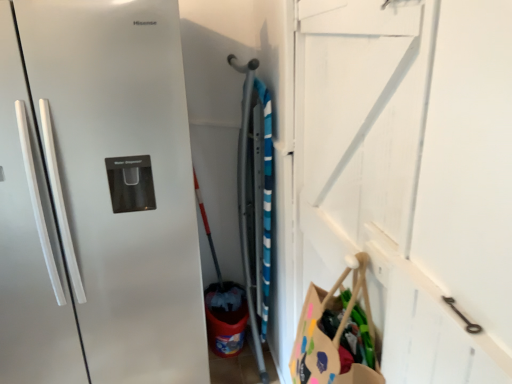
Find the location of a particular element. This screenshot has width=512, height=384. white wooden door at upper right is located at coordinates (411, 173).

In order to face white wooden door at upper right, should I rotate leftwards or rightwards?

It's best to rotate right around 16.725 degrees.

Measure the distance between point (x=311, y=240) and camera.

A distance of 5.24 feet exists between point (x=311, y=240) and camera.

What do you see at coordinates (411, 173) in the screenshot? I see `white wooden door at upper right` at bounding box center [411, 173].

At what (x,y) coordinates should I click in order to perform the action: click on satin white refrigerator handles at left. Please return your answer as a coordinate pair (x, y). The image size is (512, 384). Looking at the image, I should click on (29, 245).

Describe the element at coordinates (29, 245) in the screenshot. I see `satin white refrigerator handles at left` at that location.

At what (x,y) coordinates should I click in order to perform the action: click on white wooden door at upper right. Please return your answer as a coordinate pair (x, y). Looking at the image, I should click on (411, 173).

Is white wooden door at upper right to the right of satin white refrigerator handles at left from the viewer's perspective?

Yes, white wooden door at upper right is to the right of satin white refrigerator handles at left.

Which object is closer to the camera taking this photo, white wooden door at upper right or satin white refrigerator handles at left?

satin white refrigerator handles at left is more forward.

Which is further, [389,382] or [0,143]?

The point [0,143] is behind.

From the image's perspective, relative to satin white refrigerator handles at left, is white wooden door at upper right above or below?

white wooden door at upper right is situated higher than satin white refrigerator handles at left in the image.

From a real-world perspective, is white wooden door at upper right located beneath satin white refrigerator handles at left?

Yes, from a real-world perspective, white wooden door at upper right is under satin white refrigerator handles at left.

Considering the sizes of white wooden door at upper right and satin white refrigerator handles at left in the image, is white wooden door at upper right wider or thinner than satin white refrigerator handles at left?

Considering their sizes, white wooden door at upper right looks broader than satin white refrigerator handles at left.

Does white wooden door at upper right have a greater height compared to satin white refrigerator handles at left?

Correct, white wooden door at upper right is much taller as satin white refrigerator handles at left.

Consider the image. Is white wooden door at upper right bigger or smaller than satin white refrigerator handles at left?

Clearly, white wooden door at upper right is larger in size than satin white refrigerator handles at left.

Is satin white refrigerator handles at left completely or partially inside white wooden door at upper right?

No, satin white refrigerator handles at left is not inside white wooden door at upper right.

Is white wooden door at upper right next to satin white refrigerator handles at left and touching it?

white wooden door at upper right and satin white refrigerator handles at left are clearly separated.

Does white wooden door at upper right turn towards satin white refrigerator handles at left?

No.

Looking at this image, how many degrees apart are the facing directions of white wooden door at upper right and satin white refrigerator handles at left?

white wooden door at upper right and satin white refrigerator handles at left are facing 1.04 degrees away from each other.

The height and width of the screenshot is (384, 512). What are the coordinates of `garage door that is behind the satin white refrigerator handles at left` in the screenshot? It's located at (411, 173).

Is satin white refrigerator handles at left to the left of white wooden door at upper right from the viewer's perspective?

Correct, you'll find satin white refrigerator handles at left to the left of white wooden door at upper right.

Which is behind, satin white refrigerator handles at left or white wooden door at upper right?

white wooden door at upper right is behind.

Which is nearer, (13, 118) or (470, 274)?

Point (13, 118) appears to be farther away from the viewer than point (470, 274).

From the image's perspective, is satin white refrigerator handles at left below white wooden door at upper right?

Yes, from the image's perspective, satin white refrigerator handles at left is below white wooden door at upper right.

Consider the image. From a real-world perspective, is satin white refrigerator handles at left positioned under white wooden door at upper right based on gravity?

No, from a real-world perspective, satin white refrigerator handles at left is not under white wooden door at upper right.

Considering the sizes of objects satin white refrigerator handles at left and white wooden door at upper right in the image provided, who is thinner, satin white refrigerator handles at left or white wooden door at upper right?

Thinner between the two is satin white refrigerator handles at left.

Is satin white refrigerator handles at left taller or shorter than white wooden door at upper right?

Clearly, satin white refrigerator handles at left is shorter compared to white wooden door at upper right.

Between satin white refrigerator handles at left and white wooden door at upper right, which one has larger size?

white wooden door at upper right.

Looking at this image, do you think satin white refrigerator handles at left is within white wooden door at upper right, or outside of it?

satin white refrigerator handles at left is located beyond the bounds of white wooden door at upper right.

Based on the photo, is satin white refrigerator handles at left not close to white wooden door at upper right?

satin white refrigerator handles at left is positioned a significant distance from white wooden door at upper right.

Is satin white refrigerator handles at left oriented towards white wooden door at upper right?

No.

Can you tell me how much satin white refrigerator handles at left and white wooden door at upper right differ in facing direction?

They differ by 1.04 degrees in their facing directions.

Where is `garage door that appears below the satin white refrigerator handles at left (from a real-world perspective)`? This screenshot has width=512, height=384. garage door that appears below the satin white refrigerator handles at left (from a real-world perspective) is located at coordinates (411, 173).

Locate an element on the screen. This screenshot has height=384, width=512. garage door that is above the satin white refrigerator handles at left (from the image's perspective) is located at coordinates (411, 173).

Identify the location of garage door on the right of satin white refrigerator handles at left. The image size is (512, 384). (411, 173).